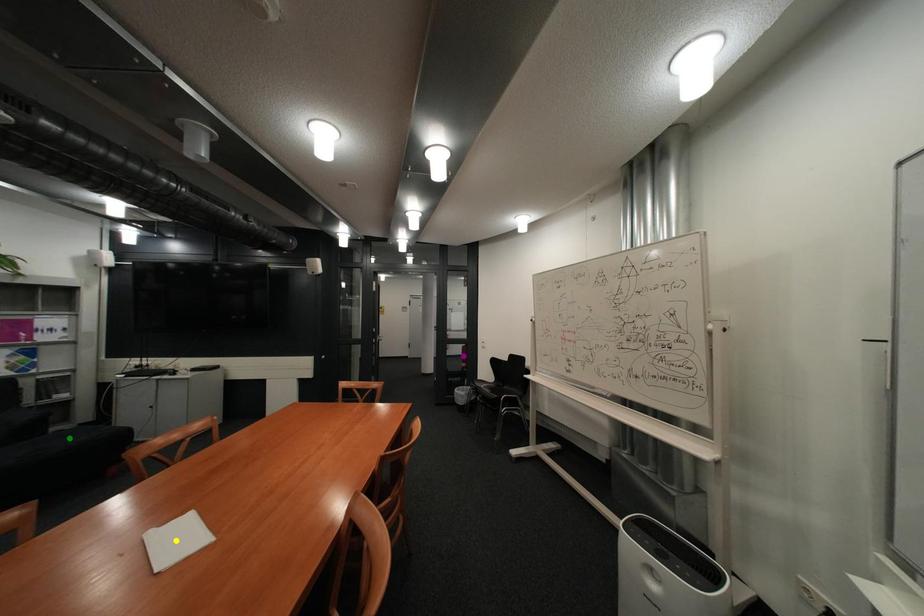
Order these from nearest to farthest:
A) yellow point
B) green point
C) purple point

yellow point
green point
purple point